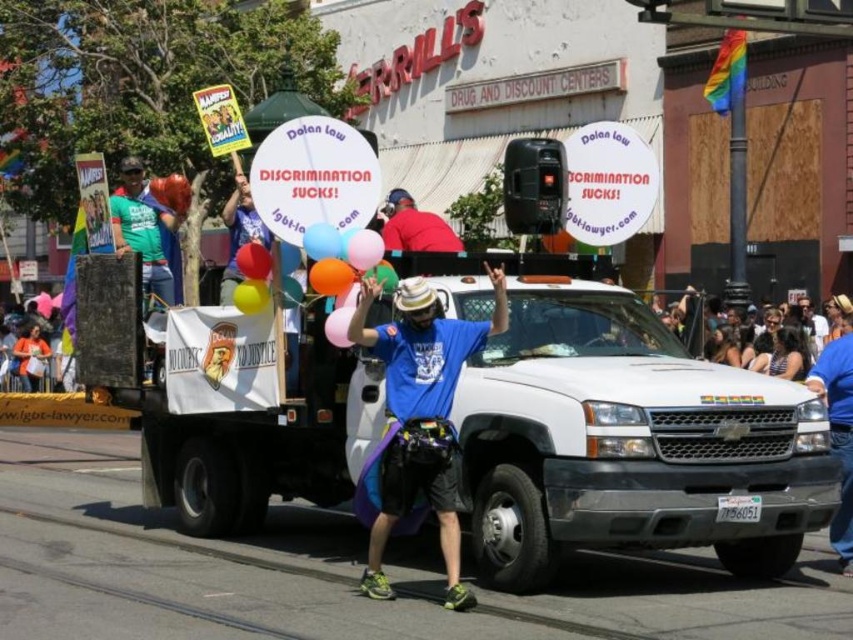
Is blue cotton shirt at center bigger than red matte shirt at upper center?

Yes.

Is point (433, 452) in front of point (410, 246)?

Yes.

You are a GUI agent. You are given a task and a screenshot of the screen. Output one action in this format:
    pyautogui.click(x=<x>, y=<y>)
    Task: Click on the blue cotton shirt at center
    The image size is (853, 640).
    Given the screenshot: What is the action you would take?
    click(x=416, y=422)

Which is more to the right, white matte truck at center or translucent plastic balloon at center?

From the viewer's perspective, white matte truck at center appears more on the right side.

From the picture: Does white matte truck at center have a smaller size compared to translucent plastic balloon at center?

Incorrect, white matte truck at center is not smaller in size than translucent plastic balloon at center.

Which is in front, point (724, 486) or point (320, 227)?

Positioned in front is point (724, 486).

The height and width of the screenshot is (640, 853). What are the coordinates of `white matte truck at center` in the screenshot? It's located at (619, 429).

Who is more forward, (x=416, y=422) or (x=316, y=257)?

Point (x=416, y=422) is more forward.

Which is more to the right, blue cotton shirt at center or translucent plastic balloon at center?

blue cotton shirt at center

Is point (444, 404) less distant than point (335, 237)?

Yes, point (444, 404) is in front of point (335, 237).

Where is `blue cotton shirt at center`? The height and width of the screenshot is (640, 853). blue cotton shirt at center is located at coordinates (416, 422).